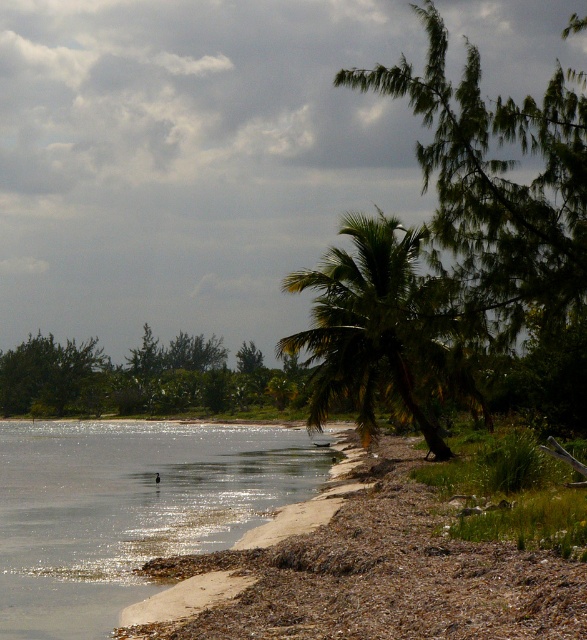
Question: Which object is farther from the camera taking this photo?

Choices:
 (A) green leafy tree at center
 (B) green leafy palm tree at center
 (C) clear water at lower left

Answer: (A)

Question: Can you confirm if green leafy palm tree at center is positioned below green leafy tree at center?

Choices:
 (A) no
 (B) yes

Answer: (A)

Question: Which point is closer to the camera?

Choices:
 (A) green leafy palm tree at center
 (B) clear water at lower left
 (C) green leafy tree at center

Answer: (A)

Question: Is clear water at lower left positioned before green leafy palm tree at center?

Choices:
 (A) no
 (B) yes

Answer: (A)

Question: Is green leafy palm tree at center below green leafy tree at center?

Choices:
 (A) no
 (B) yes

Answer: (A)

Question: Estimate the real-world distances between objects in this image. Which object is closer to the green leafy palm tree at center?

Choices:
 (A) clear water at lower left
 (B) green leafy tree at center

Answer: (A)